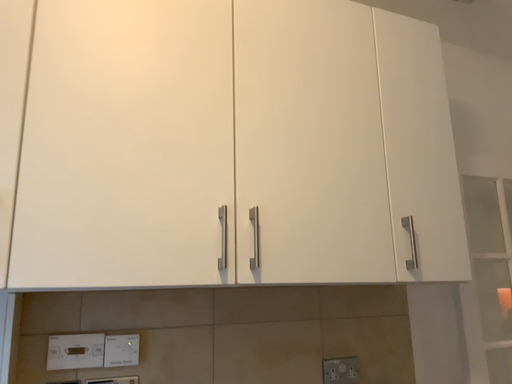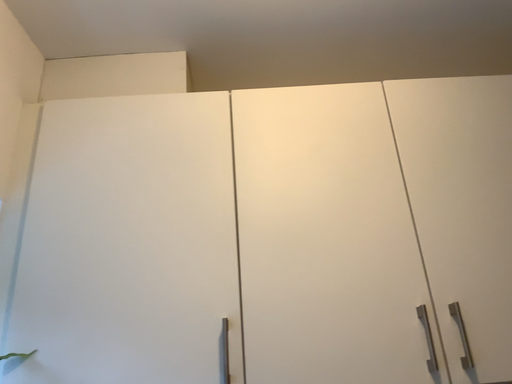
Question: How did the camera likely rotate when shooting the video?

Choices:
 (A) rotated upward
 (B) rotated downward

Answer: (A)